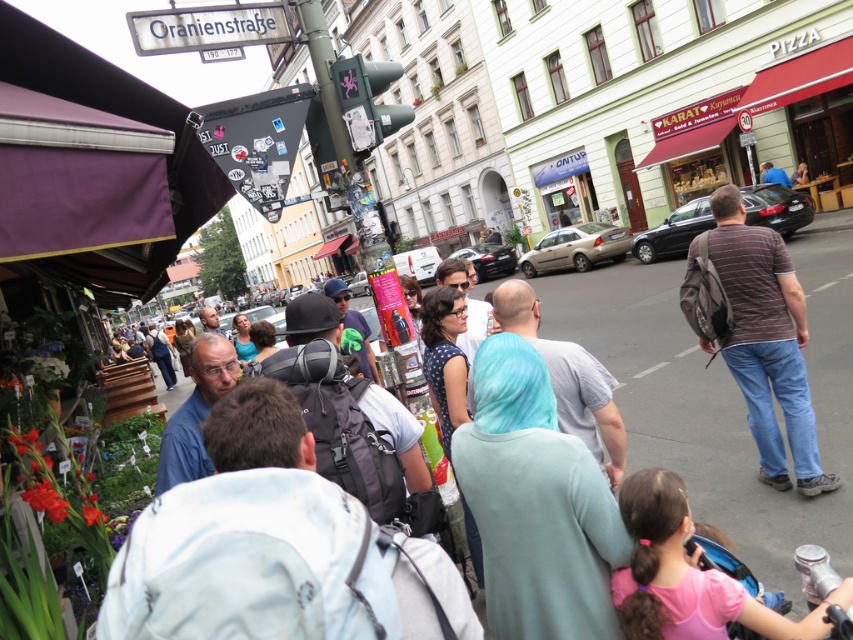
Question: Does purple fabric canopy at upper left lie behind striped cotton shirt at center?

Choices:
 (A) yes
 (B) no

Answer: (B)

Question: Is purple fabric canopy at upper left positioned before striped cotton shirt at center?

Choices:
 (A) no
 (B) yes

Answer: (B)

Question: Which point appears farthest from the camera in this image?

Choices:
 (A) (41, 141)
 (B) (730, 243)

Answer: (B)

Question: In this image, where is purple fabric canopy at upper left located relative to striped cotton shirt at center?

Choices:
 (A) below
 (B) above

Answer: (B)

Question: Which point is farther from the camera taking this photo?

Choices:
 (A) (184, 131)
 (B) (815, 488)

Answer: (B)